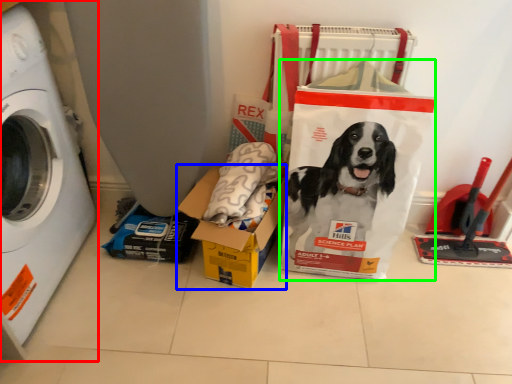
Question: Which object is positioned farthest from washing machine (highlighted by a red box)? Select from box (highlighted by a blue box) and paper bag (highlighted by a green box).

Choices:
 (A) box
 (B) paper bag

Answer: (B)